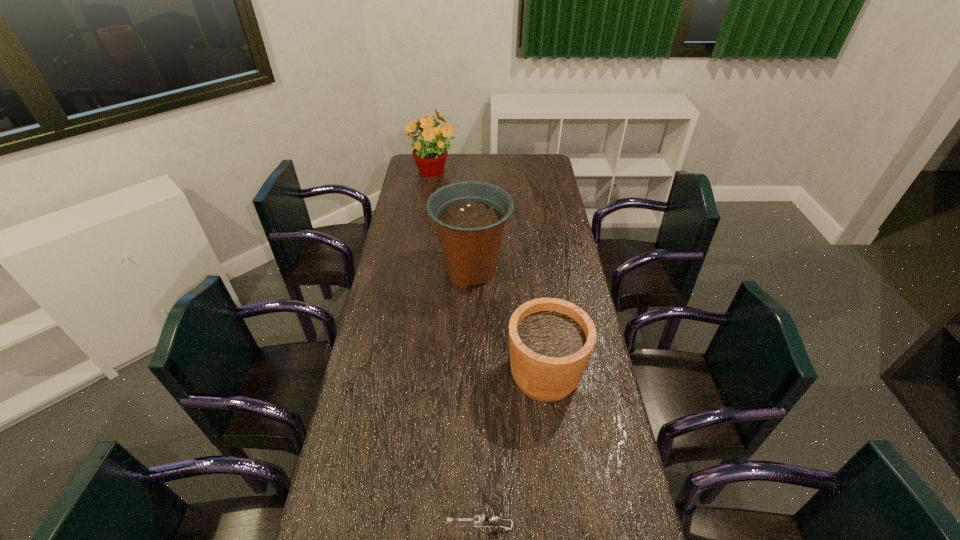
This screenshot has height=540, width=960. I want to click on free space located 0.250m aimed along the barrel of the shortest object, so click(x=349, y=526).

Identify the location of free space located aimed along the barrel of the shortest object. This screenshot has width=960, height=540. (385, 526).

You are a GUI agent. You are given a task and a screenshot of the screen. Output one action in this format:
    pyautogui.click(x=<x>, y=<y>)
    Task: Click on the object located in the far edge section of the desktop
    The height and width of the screenshot is (540, 960).
    Given the screenshot: What is the action you would take?
    pyautogui.click(x=430, y=153)

The image size is (960, 540). Identify the location of object positioned at the left edge. (430, 153).

Where is `object at the right edge`? The height and width of the screenshot is (540, 960). object at the right edge is located at coordinates (551, 340).

In order to click on object at the far left corner in this screenshot , I will do (430, 153).

Where is `vacant area at the far edge`? The image size is (960, 540). vacant area at the far edge is located at coordinates (507, 161).

Identify the location of free location at the left edge. The width and height of the screenshot is (960, 540). (412, 207).

At what (x,y) coordinates should I click in order to perform the action: click on vacant space at the right edge of the desktop. Please return your answer as a coordinate pair (x, y). Looking at the image, I should click on (557, 246).

The height and width of the screenshot is (540, 960). Find the location of `empty location between the second farthest object and the shortest object`. empty location between the second farthest object and the shortest object is located at coordinates (476, 399).